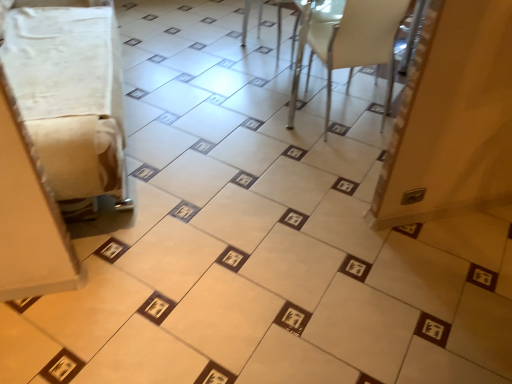
Question: Is white fabric at left, acting as the second furniture starting from the right, facing away from white plastic chair at upper right, which is counted as the 1th furniture, starting from the right?

Choices:
 (A) no
 (B) yes

Answer: (A)

Question: Can you confirm if white fabric at left, acting as the second furniture starting from the right, is shorter than white plastic chair at upper right, which ranks as the 2th furniture in left-to-right order?

Choices:
 (A) yes
 (B) no

Answer: (A)

Question: Is white fabric at left, acting as the second furniture starting from the right, facing towards white plastic chair at upper right, which ranks as the 2th furniture in left-to-right order?

Choices:
 (A) yes
 (B) no

Answer: (A)

Question: Does white fabric at left, acting as the second furniture starting from the right, lie in front of white plastic chair at upper right, which ranks as the 2th furniture in left-to-right order?

Choices:
 (A) no
 (B) yes

Answer: (B)

Question: Considering the relative sizes of white fabric at left, acting as the second furniture starting from the right, and white plastic chair at upper right, which ranks as the 2th furniture in left-to-right order, in the image provided, is white fabric at left, acting as the second furniture starting from the right, bigger than white plastic chair at upper right, which ranks as the 2th furniture in left-to-right order,?

Choices:
 (A) no
 (B) yes

Answer: (B)

Question: From a real-world perspective, is white fabric at left, which is the first furniture from left to right, beneath white plastic chair at upper right, which is counted as the 1th furniture, starting from the right?

Choices:
 (A) no
 (B) yes

Answer: (A)

Question: Is white plastic chair at upper right, which is counted as the 1th furniture, starting from the right, shorter than white fabric at left, acting as the second furniture starting from the right?

Choices:
 (A) yes
 (B) no

Answer: (B)

Question: Can you confirm if white plastic chair at upper right, which ranks as the 2th furniture in left-to-right order, is wider than white fabric at left, acting as the second furniture starting from the right?

Choices:
 (A) yes
 (B) no

Answer: (B)

Question: Could you tell me if white plastic chair at upper right, which ranks as the 2th furniture in left-to-right order, is turned towards white fabric at left, which is the first furniture from left to right?

Choices:
 (A) yes
 (B) no

Answer: (B)

Question: From a real-world perspective, is white plastic chair at upper right, which ranks as the 2th furniture in left-to-right order, located higher than white fabric at left, acting as the second furniture starting from the right?

Choices:
 (A) yes
 (B) no

Answer: (B)

Question: Considering the relative sizes of white plastic chair at upper right, which ranks as the 2th furniture in left-to-right order, and white fabric at left, which is the first furniture from left to right, in the image provided, is white plastic chair at upper right, which ranks as the 2th furniture in left-to-right order, taller than white fabric at left, which is the first furniture from left to right,?

Choices:
 (A) no
 (B) yes

Answer: (B)

Question: Considering the relative sizes of white plastic chair at upper right, which ranks as the 2th furniture in left-to-right order, and white fabric at left, which is the first furniture from left to right, in the image provided, is white plastic chair at upper right, which ranks as the 2th furniture in left-to-right order, bigger than white fabric at left, which is the first furniture from left to right,?

Choices:
 (A) yes
 (B) no

Answer: (B)

Question: Considering the relative positions of white fabric at left, which is the first furniture from left to right, and white plastic chair at upper right, which ranks as the 2th furniture in left-to-right order, in the image provided, is white fabric at left, which is the first furniture from left to right, to the left or to the right of white plastic chair at upper right, which ranks as the 2th furniture in left-to-right order,?

Choices:
 (A) right
 (B) left

Answer: (B)